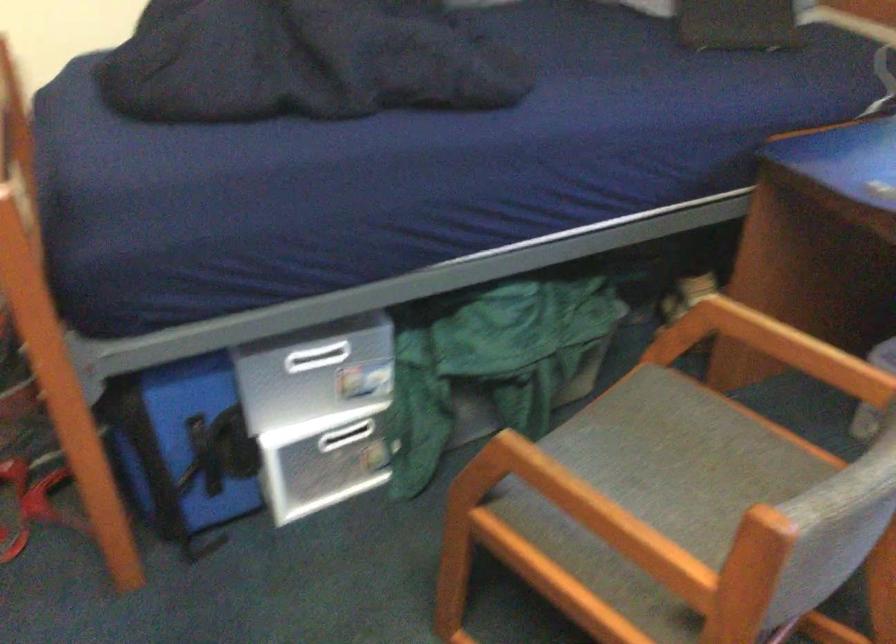
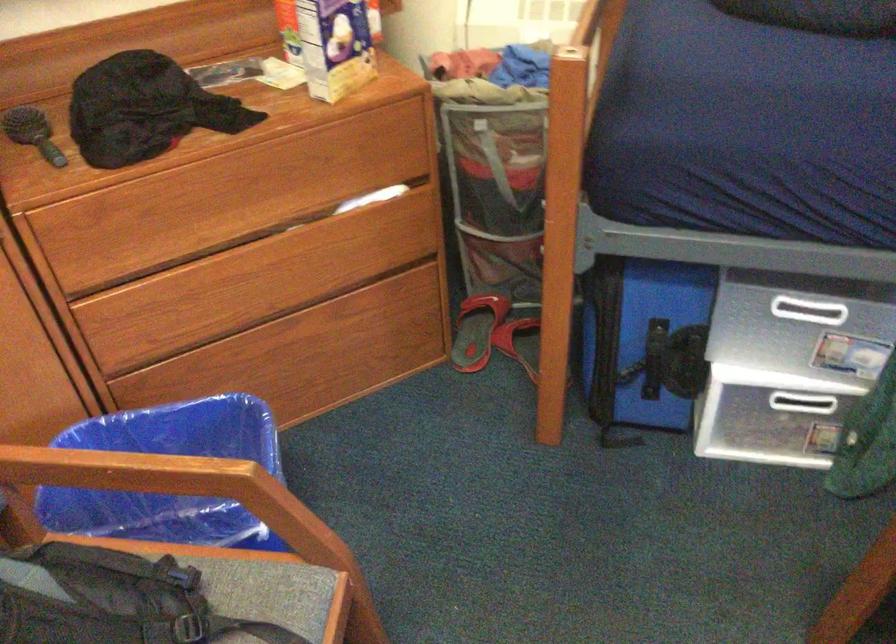
Question: The camera is either moving clockwise (left) or counter-clockwise (right) around the object. The first image is from the beginning of the video and the second image is from the end. Is the camera moving left or right when shooting the video?

Choices:
 (A) Left
 (B) Right

Answer: (B)